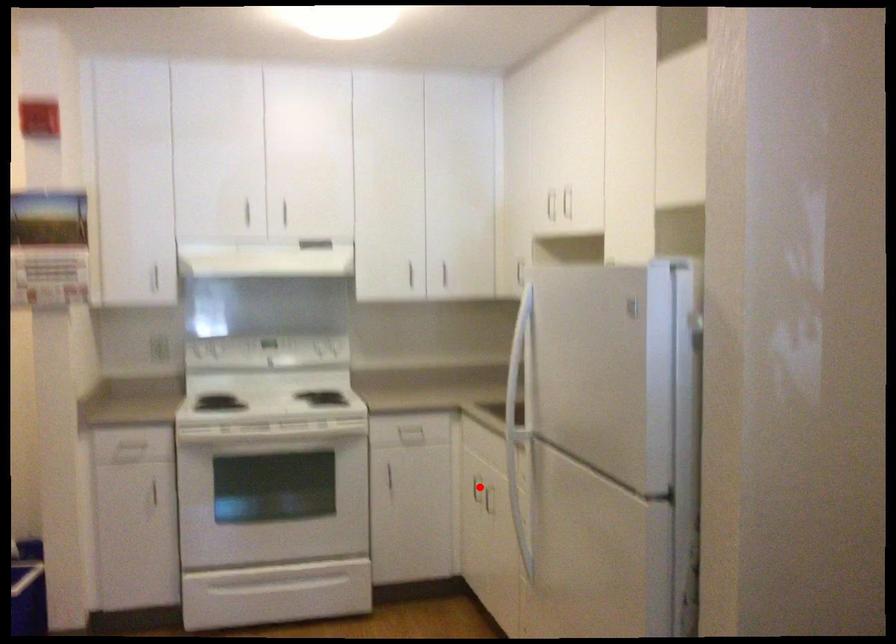
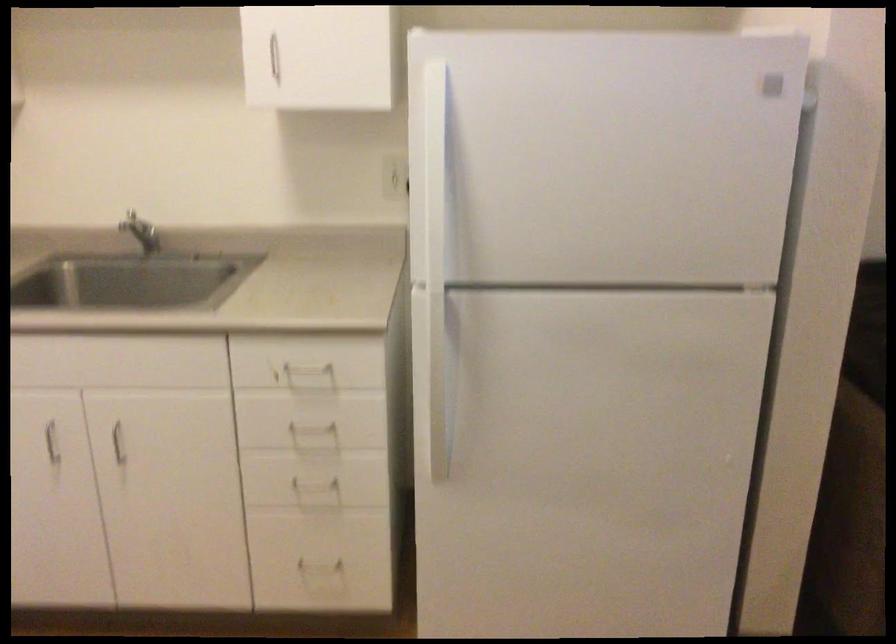
Question: I am providing you with two images of the same scene from different viewpoints. A red point is marked on the first image. Is the red point's position out of view in image 2?

Choices:
 (A) Yes
 (B) No

Answer: (B)